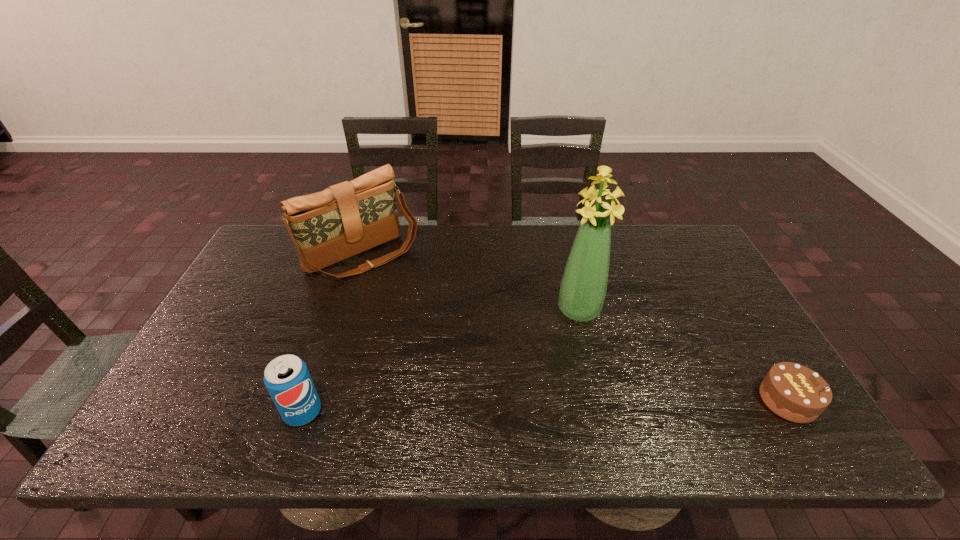
At what (x,y) coordinates should I click in order to perform the action: click on vacant area at the far edge. Please return your answer as a coordinate pair (x, y). Looking at the image, I should click on (652, 265).

The height and width of the screenshot is (540, 960). Identify the location of vacant space at the near edge of the desktop. (556, 406).

The image size is (960, 540). What are the coordinates of `free spot at the left edge of the desktop` in the screenshot? It's located at (201, 346).

Where is `vacant region at the right edge of the desktop`? The height and width of the screenshot is (540, 960). vacant region at the right edge of the desktop is located at coordinates (685, 270).

The image size is (960, 540). In order to click on vacant region at the far left corner of the desktop in this screenshot , I will do 270,233.

Where is `free space between the chocolate cake and the third tallest object`? free space between the chocolate cake and the third tallest object is located at coordinates (545, 406).

The image size is (960, 540). I want to click on free space between the third shortest object and the soda can, so click(332, 334).

You are a GUI agent. You are given a task and a screenshot of the screen. Output one action in this format:
    pyautogui.click(x=<x>, y=<y>)
    Task: Click on the free spot between the third tallest object and the tallest object
    The image size is (960, 540).
    Given the screenshot: What is the action you would take?
    pyautogui.click(x=441, y=361)

Locate an element on the screen. This screenshot has width=960, height=540. free area in between the second shortest object and the chocolate cake is located at coordinates (545, 406).

Where is `free space between the chocolate cake and the farthest object`? free space between the chocolate cake and the farthest object is located at coordinates (575, 328).